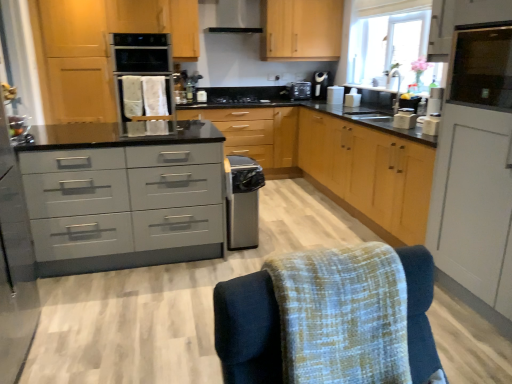
Question: From a real-world perspective, is satin black coffee machine at upper right above or below transparent glass window screen at upper right?

Choices:
 (A) below
 (B) above

Answer: (A)

Question: Considering their positions, is satin black coffee machine at upper right located in front of or behind transparent glass window screen at upper right?

Choices:
 (A) behind
 (B) front

Answer: (A)

Question: Which object is the closest to the matte gray drawers at center?

Choices:
 (A) black matte stove at center
 (B) transparent glass window at upper right
 (C) wooden cabinet at center, the 1th cabinetry in the back-to-front sequence
 (D) satin black exhaust hood at upper center
 (E) black plastic toaster at upper center, placed as the fifth appliance when sorted from bottom to top

Answer: (C)

Question: Which object is positioned closest to the white plastic toaster at right, the first appliance viewed from the front?

Choices:
 (A) wooden cabinet at center, the fourth cabinetry positioned from the front
 (B) matte wood cabinet at upper right, acting as the 3th cabinetry starting from the left
 (C) transparent glass window screen at upper right
 (D) matte gray drawers at center
 (E) satin silver toaster at center, marked as the 1th appliance in a left-to-right arrangement

Answer: (C)